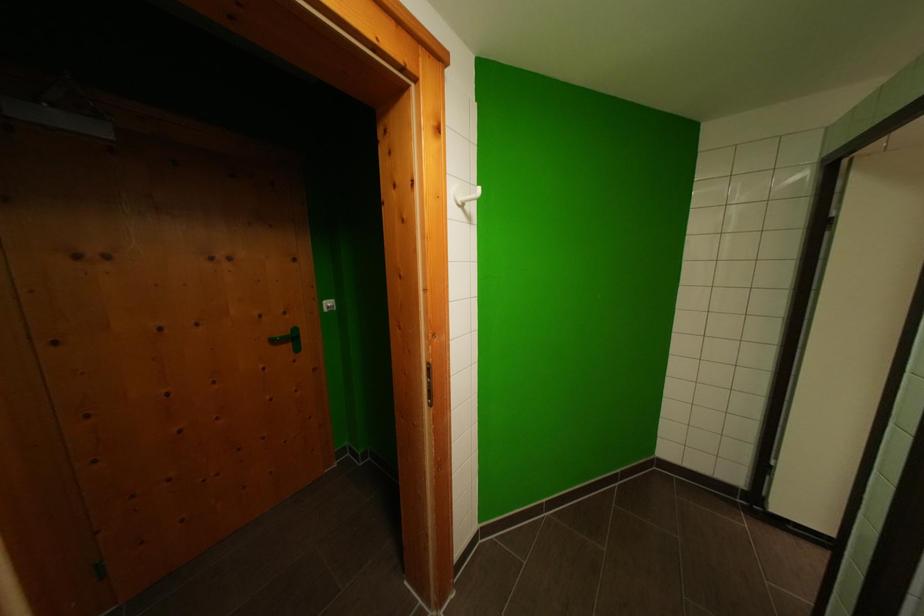
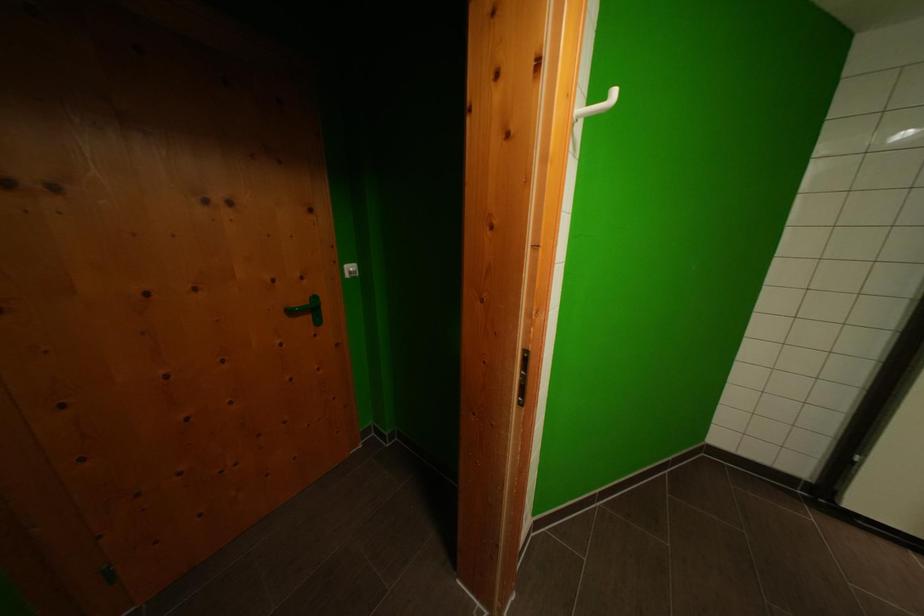
Question: Based on the continuous images, in which direction is the camera rotating? Reply with the corresponding letter.

Choices:
 (A) Left
 (B) Right
 (C) Up
 (D) Down

Answer: (D)